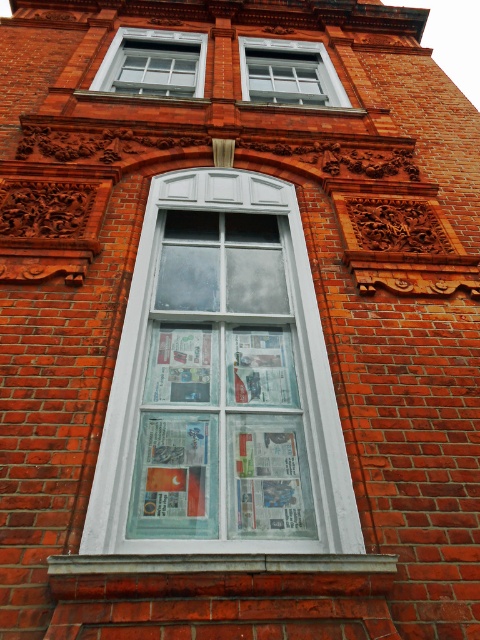
You are standing in front of a brick building and see two points marked on the wall. The first point is labeled as point (244,353) and the second is point (336,104). Which point is closer to you?

Point (244,353) is closer to you because it is in front of point (336,104).

You are a painter standing at the base of the brick building. You need to paint both the white glass window at center and the clear glass window at upper center. Given that your ladder can reach up to 10 feet, can you safely paint both windows without moving the ladder?

The white glass window at center and clear glass window at upper center are 11.53 feet apart from each other. Since your ladder can only reach up to 10 feet, you cannot safely paint both windows without moving the ladder because the distance between them exceeds the ladder height limit.